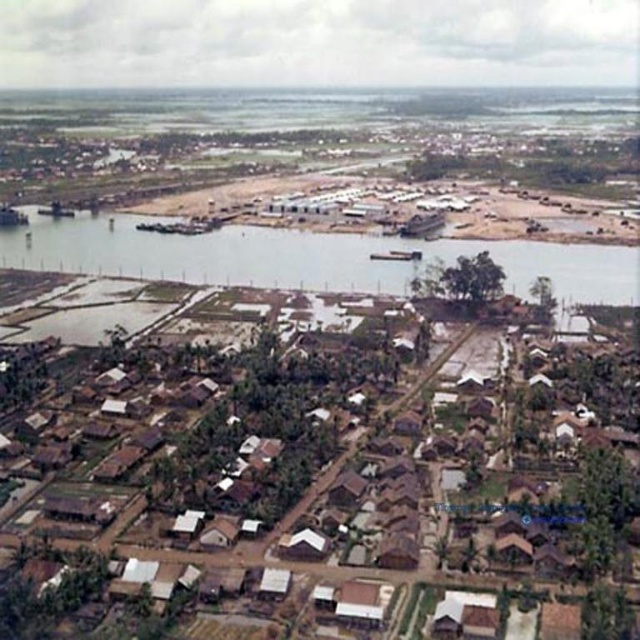
Question: Among these points, which one is farthest from the camera?

Choices:
 (A) (83, 228)
 (B) (561, 429)

Answer: (A)

Question: From the image, what is the correct spatial relationship of brown thatched-roof houses at lower left in relation to brown earthy river at center?

Choices:
 (A) left
 (B) right

Answer: (B)

Question: Is brown thatched-roof houses at lower left positioned behind brown earthy river at center?

Choices:
 (A) no
 (B) yes

Answer: (A)

Question: Which of the following is the closest to the observer?

Choices:
 (A) brown thatched-roof houses at lower left
 (B) brown earthy river at center

Answer: (A)

Question: Can you confirm if brown thatched-roof houses at lower left is bigger than brown earthy river at center?

Choices:
 (A) yes
 (B) no

Answer: (B)